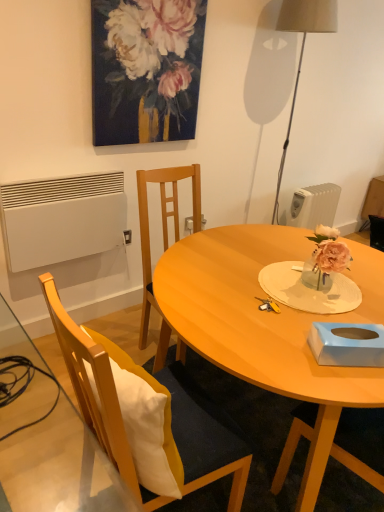
At what (x,y) coordinates should I click in order to perform the action: click on oil paint canvas at upper center. Please return your answer as a coordinate pair (x, y). Looking at the image, I should click on (146, 69).

What do you see at coordinates (146, 69) in the screenshot?
I see `oil paint canvas at upper center` at bounding box center [146, 69].

The height and width of the screenshot is (512, 384). I want to click on wooden chair at left, so click(x=148, y=417).

At what (x,y) coordinates should I click in order to perform the action: click on blue cardboard tissue box at lower right. Please return your answer as a coordinate pair (x, y). The width and height of the screenshot is (384, 512). Looking at the image, I should click on (347, 344).

Locate an element on the screen. The width and height of the screenshot is (384, 512). matte wood table at center is located at coordinates (269, 324).

Which is more to the left, white matte radiator at lower left, the second radiator positioned from the back, or blue cardboard tissue box at lower right?

white matte radiator at lower left, the second radiator positioned from the back, is more to the left.

Considering the sizes of white matte radiator at lower left, the second radiator positioned from the back, and blue cardboard tissue box at lower right in the image, is white matte radiator at lower left, the second radiator positioned from the back, taller or shorter than blue cardboard tissue box at lower right?

Clearly, white matte radiator at lower left, the second radiator positioned from the back, is taller compared to blue cardboard tissue box at lower right.

From the picture: Is white matte radiator at lower left, which is the first radiator in front-to-back order, turned away from blue cardboard tissue box at lower right?

No, white matte radiator at lower left, which is the first radiator in front-to-back order, is not facing the opposite direction of blue cardboard tissue box at lower right.

Is point (118, 209) closer to viewer compared to point (336, 341)?

That is False.

Do you think wooden chair at left is within matte wood table at center, or outside of it?

wooden chair at left is located beyond the bounds of matte wood table at center.

In terms of height, does wooden chair at left look taller or shorter compared to matte wood table at center?

Clearly, wooden chair at left is taller compared to matte wood table at center.

From the picture: Is wooden chair at left facing towards matte wood table at center?

Yes, wooden chair at left faces towards matte wood table at center.

Which of these two, blue cardboard tissue box at lower right or wooden chair at left, is wider?

wooden chair at left.

Is blue cardboard tissue box at lower right with wooden chair at left?

No, blue cardboard tissue box at lower right is not in contact with wooden chair at left.

Considering the sizes of blue cardboard tissue box at lower right and wooden chair at left in the image, is blue cardboard tissue box at lower right taller or shorter than wooden chair at left?

blue cardboard tissue box at lower right is shorter than wooden chair at left.

Is matte wood table at center a part of white matte radiator at lower left, the second radiator positioned from the back?

No, matte wood table at center is not inside white matte radiator at lower left, the second radiator positioned from the back.

From a real-world perspective, relative to matte wood table at center, is white matte radiator at lower left, the 1th radiator when ordered from left to right, vertically above or below?

In terms of real-world spatial position, white matte radiator at lower left, the 1th radiator when ordered from left to right, is above matte wood table at center.

What's the angular difference between white matte radiator at lower left, the second radiator in the right-to-left sequence, and matte wood table at center's facing directions?

The angular difference between white matte radiator at lower left, the second radiator in the right-to-left sequence, and matte wood table at center is 90.1 degrees.

Considering the relative sizes of white matte radiator at lower left, the 1th radiator when ordered from left to right, and matte wood table at center in the image provided, is white matte radiator at lower left, the 1th radiator when ordered from left to right, wider than matte wood table at center?

In fact, white matte radiator at lower left, the 1th radiator when ordered from left to right, might be narrower than matte wood table at center.

Can you confirm if white plastic radiator at right, the 1th radiator viewed from the right, is positioned to the left of wooden chair at left?

In fact, white plastic radiator at right, the 1th radiator viewed from the right, is to the right of wooden chair at left.

From a real-world perspective, who is located higher, white plastic radiator at right, positioned as the 2th radiator in left-to-right order, or wooden chair at left?

From a 3D spatial view, wooden chair at left is above.

Find the location of a particular element. chair that appears on the left of white plastic radiator at right, marked as the 1th radiator in a back-to-front arrangement is located at coordinates (148, 417).

In the scene shown: Which of these two, white plastic radiator at right, positioned as the 2th radiator in left-to-right order, or wooden chair at left, stands shorter?

white plastic radiator at right, positioned as the 2th radiator in left-to-right order.

Is point (186, 280) closer to viewer compared to point (44, 188)?

Yes, point (186, 280) is closer to viewer.

Could you measure the distance between matte wood table at center and white matte radiator at lower left, the 1th radiator when ordered from left to right?

33.08 inches.

From the image's perspective, which one is positioned lower, matte wood table at center or white matte radiator at lower left, which is the first radiator in front-to-back order?

matte wood table at center, from the image's perspective.

Can you confirm if matte wood table at center is thinner than white matte radiator at lower left, the second radiator positioned from the back?

No.

From the image's perspective, which object appears higher, white matte radiator at lower left, the second radiator in the right-to-left sequence, or wooden chair at left?

white matte radiator at lower left, the second radiator in the right-to-left sequence, from the image's perspective.

Considering the relative sizes of white matte radiator at lower left, the second radiator positioned from the back, and wooden chair at left in the image provided, is white matte radiator at lower left, the second radiator positioned from the back, bigger than wooden chair at left?

Actually, white matte radiator at lower left, the second radiator positioned from the back, might be smaller than wooden chair at left.

Considering the relative positions of white matte radiator at lower left, the second radiator positioned from the back, and wooden chair at left in the image provided, is white matte radiator at lower left, the second radiator positioned from the back, to the left or to the right of wooden chair at left?

In the image, white matte radiator at lower left, the second radiator positioned from the back, appears on the left side of wooden chair at left.

In terms of height, does white matte radiator at lower left, the second radiator in the right-to-left sequence, look taller or shorter compared to wooden chair at left?

white matte radiator at lower left, the second radiator in the right-to-left sequence, is shorter than wooden chair at left.

From a real-world perspective, count 1st radiators downward from the blue cardboard tissue box at lower right and point to it. Please provide its 2D coordinates.

[(61, 218)]

What are the coordinates of `chair below the matte wood table at center (from the image's perspective)` in the screenshot? It's located at (148, 417).

Looking at the image, which one is located further to white plastic radiator at right, the 1th radiator viewed from the right, oil paint canvas at upper center or blue cardboard tissue box at lower right?

blue cardboard tissue box at lower right is positioned further to the anchor white plastic radiator at right, the 1th radiator viewed from the right.

From the image, which object appears to be nearer to white matte radiator at lower left, the 1th radiator when ordered from left to right, oil paint canvas at upper center or wooden chair at left?

oil paint canvas at upper center is positioned closer to the anchor white matte radiator at lower left, the 1th radiator when ordered from left to right.

From the picture: From the image, which object appears to be farther from matte wood table at center, oil paint canvas at upper center or white matte radiator at lower left, the 1th radiator when ordered from left to right?

oil paint canvas at upper center is further to matte wood table at center.

Based on their spatial positions, is blue cardboard tissue box at lower right or matte wood table at center further from wooden chair at left?

The object further to wooden chair at left is blue cardboard tissue box at lower right.

Considering their positions, is oil paint canvas at upper center positioned further to blue cardboard tissue box at lower right than wooden chair at left?

oil paint canvas at upper center is further to blue cardboard tissue box at lower right.

Which object lies nearer to the anchor point blue cardboard tissue box at lower right, white plastic radiator at right, which is counted as the 2th radiator, starting from the front, or matte wood table at center?

matte wood table at center is positioned closer to the anchor blue cardboard tissue box at lower right.

From the image, which object appears to be nearer to wooden chair at left, matte wood table at center or white plastic radiator at right, positioned as the 2th radiator in left-to-right order?

matte wood table at center is closer to wooden chair at left.

Estimate the real-world distances between objects in this image. Which object is further from oil paint canvas at upper center, matte wood table at center or blue cardboard tissue box at lower right?

Among the two, blue cardboard tissue box at lower right is located further to oil paint canvas at upper center.

Locate an element on the screen. box between oil paint canvas at upper center and wooden chair at left in the vertical direction is located at coordinates (347, 344).

Find the location of a particular element. The width and height of the screenshot is (384, 512). desk situated between wooden chair at left and blue cardboard tissue box at lower right from left to right is located at coordinates (269, 324).

The height and width of the screenshot is (512, 384). In order to click on box between wooden chair at left and white plastic radiator at right, positioned as the 2th radiator in left-to-right order, from front to back in this screenshot , I will do `click(347, 344)`.

This screenshot has width=384, height=512. What are the coordinates of `picture frame positioned between blue cardboard tissue box at lower right and white plastic radiator at right, marked as the 1th radiator in a back-to-front arrangement, from near to far` in the screenshot? It's located at (146, 69).